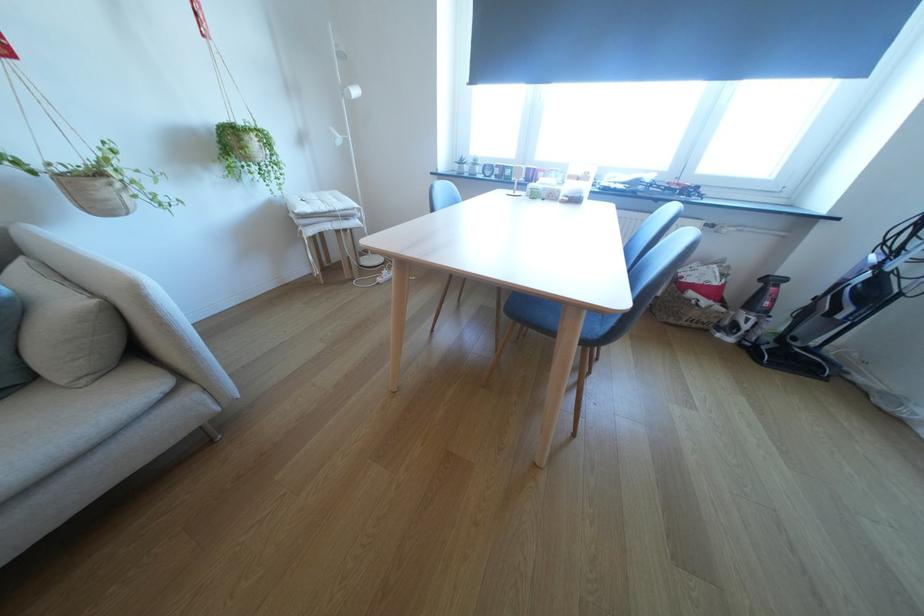
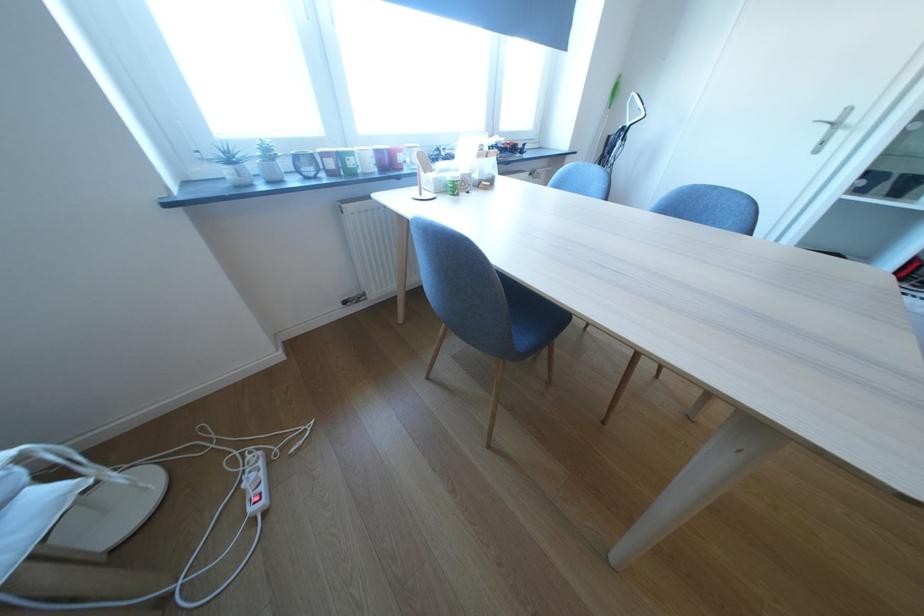
Locate, in the second image, the point that corresponds to the point at 545,171 in the first image.

(399, 151)